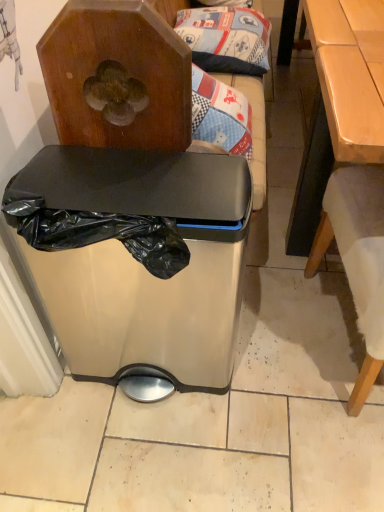
Identify the location of satin silver trash can at center. The width and height of the screenshot is (384, 512). (136, 262).

This screenshot has height=512, width=384. Describe the element at coordinates (136, 262) in the screenshot. I see `satin silver trash can at center` at that location.

Locate an element on the screen. This screenshot has width=384, height=512. patterned fabric pillow at upper center is located at coordinates (226, 39).

Where is `satin silver trash can at center`? satin silver trash can at center is located at coordinates (136, 262).

Is light brown wooden table at right outside of patterned fabric pillow at upper center?

That's correct, light brown wooden table at right is outside of patterned fabric pillow at upper center.

In the image, is light brown wooden table at right on the left side or the right side of patterned fabric pillow at upper center?

Based on their positions, light brown wooden table at right is located to the right of patterned fabric pillow at upper center.

How many degrees apart are the facing directions of light brown wooden table at right and patterned fabric pillow at upper center?

They differ by 0.804 degrees in their facing directions.

Who is smaller, light brown wooden table at right or patterned fabric pillow at upper center?

patterned fabric pillow at upper center.

Consider the image. Is patterned fabric pillow at upper center shorter than satin silver trash can at center?

Correct, patterned fabric pillow at upper center is not as tall as satin silver trash can at center.

Which is more to the left, patterned fabric pillow at upper center or satin silver trash can at center?

From the viewer's perspective, satin silver trash can at center appears more on the left side.

Does patterned fabric pillow at upper center lie in front of satin silver trash can at center?

No, the depth of patterned fabric pillow at upper center is greater than that of satin silver trash can at center.

Which object is thinner, patterned fabric pillow at upper center or satin silver trash can at center?

satin silver trash can at center.

The image size is (384, 512). In order to click on pillow that is behind the light brown wooden table at right in this screenshot , I will do `click(226, 39)`.

Considering the sizes of objects patterned fabric pillow at upper center and light brown wooden table at right in the image provided, who is wider, patterned fabric pillow at upper center or light brown wooden table at right?

light brown wooden table at right.

From the image's perspective, which is below, patterned fabric pillow at upper center or light brown wooden table at right?

patterned fabric pillow at upper center appears lower in the image.

Who is smaller, patterned fabric pillow at upper center or light brown wooden table at right?

Smaller between the two is patterned fabric pillow at upper center.

Is satin silver trash can at center situated inside patterned fabric pillow at upper center or outside?

satin silver trash can at center is not enclosed by patterned fabric pillow at upper center.

Can you confirm if satin silver trash can at center is shorter than patterned fabric pillow at upper center?

No.

Considering the sizes of objects satin silver trash can at center and patterned fabric pillow at upper center in the image provided, who is thinner, satin silver trash can at center or patterned fabric pillow at upper center?

satin silver trash can at center is thinner.

Between satin silver trash can at center and patterned fabric pillow at upper center, which one appears on the right side from the viewer's perspective?

Positioned to the right is patterned fabric pillow at upper center.

Considering the sizes of light brown wooden table at right and satin silver trash can at center in the image, is light brown wooden table at right taller or shorter than satin silver trash can at center?

light brown wooden table at right is taller than satin silver trash can at center.

Is light brown wooden table at right in contact with satin silver trash can at center?

No, light brown wooden table at right is not next to satin silver trash can at center.

Considering the positions of objects light brown wooden table at right and satin silver trash can at center in the image provided, who is more to the left, light brown wooden table at right or satin silver trash can at center?

satin silver trash can at center.

Is satin silver trash can at center touching light brown wooden table at right?

No.

Find the location of `trash bin/can below the light brown wooden table at right (from the image's perspective)`. trash bin/can below the light brown wooden table at right (from the image's perspective) is located at coordinates (136, 262).

Is satin silver trash can at center positioned with its back to light brown wooden table at right?

No, satin silver trash can at center is not facing the opposite direction of light brown wooden table at right.

Which object is positioned more to the right, satin silver trash can at center or light brown wooden table at right?

Positioned to the right is light brown wooden table at right.

Find the location of `pillow that is behind the light brown wooden table at right`. pillow that is behind the light brown wooden table at right is located at coordinates (226, 39).

At what (x,y) coordinates should I click in order to perform the action: click on pillow lying on the right of satin silver trash can at center. Please return your answer as a coordinate pair (x, y). This screenshot has height=512, width=384. Looking at the image, I should click on (226, 39).

Looking at the image, which one is located closer to satin silver trash can at center, patterned fabric pillow at upper center or light brown wooden table at right?

Based on the image, light brown wooden table at right appears to be nearer to satin silver trash can at center.

When comparing their distances from patterned fabric pillow at upper center, does satin silver trash can at center or light brown wooden table at right seem further?

satin silver trash can at center is positioned further to the anchor patterned fabric pillow at upper center.

Looking at the image, which one is located closer to light brown wooden table at right, patterned fabric pillow at upper center or satin silver trash can at center?

patterned fabric pillow at upper center lies closer to light brown wooden table at right than the other object.

When comparing their distances from light brown wooden table at right, does satin silver trash can at center or patterned fabric pillow at upper center seem further?

Based on the image, satin silver trash can at center appears to be further to light brown wooden table at right.

Based on their spatial positions, is light brown wooden table at right or satin silver trash can at center further from patterned fabric pillow at upper center?

satin silver trash can at center is positioned further to the anchor patterned fabric pillow at upper center.

Considering their positions, is light brown wooden table at right positioned further to satin silver trash can at center than patterned fabric pillow at upper center?

Among the two, patterned fabric pillow at upper center is located further to satin silver trash can at center.

I want to click on pillow between light brown wooden table at right and satin silver trash can at center in the vertical direction, so click(226, 39).